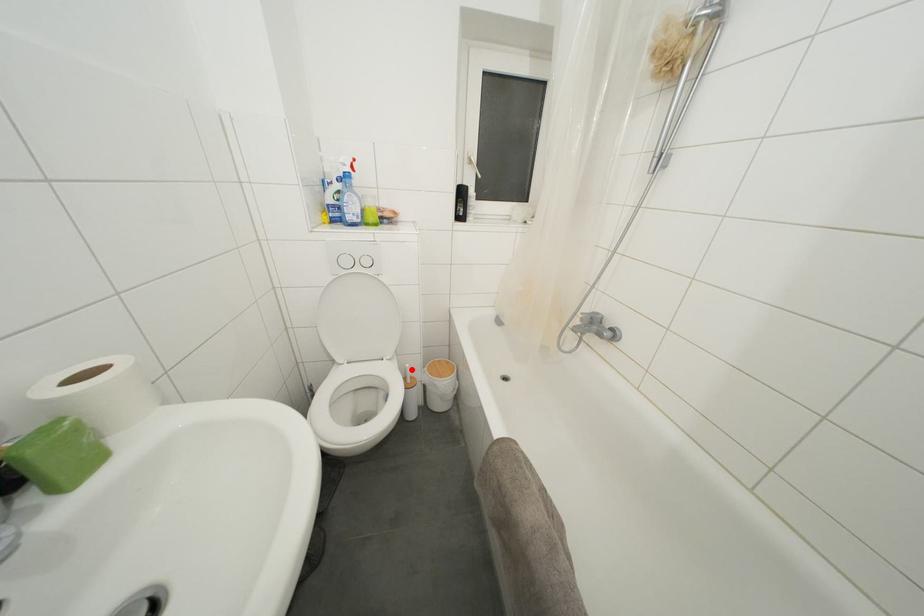
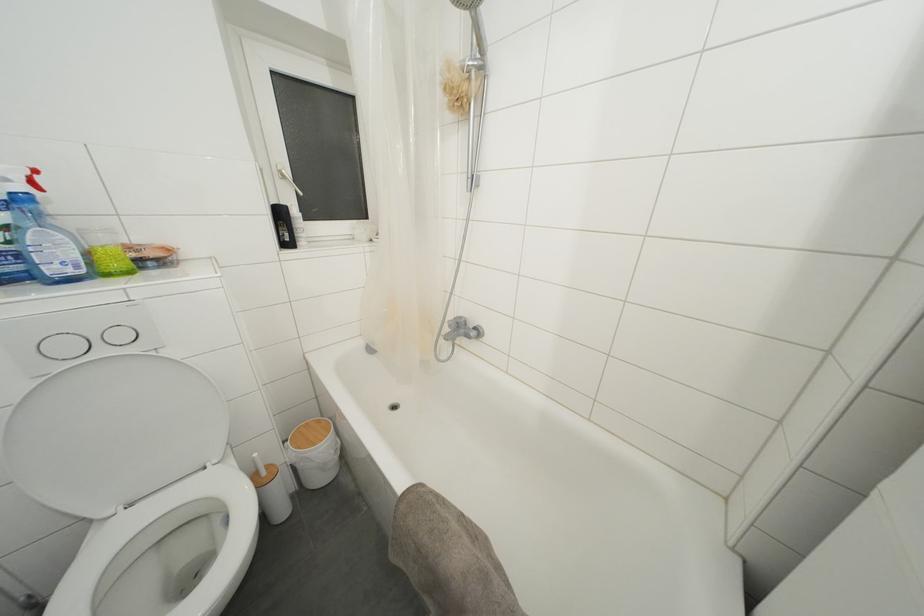
The point at the highlighted location is marked in the first image. Where is the corresponding point in the second image?

(260, 459)